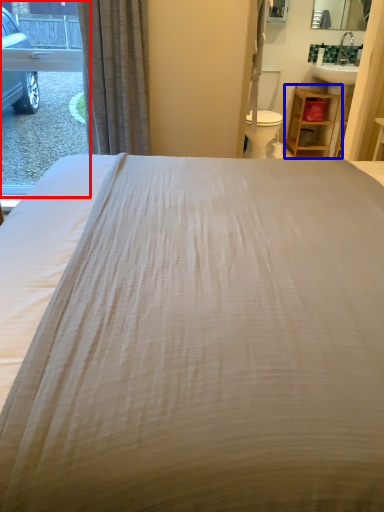
Question: Which of the following is the closest to the observer, window (highlighted by a red box) or furniture (highlighted by a blue box)?

Choices:
 (A) window
 (B) furniture

Answer: (A)